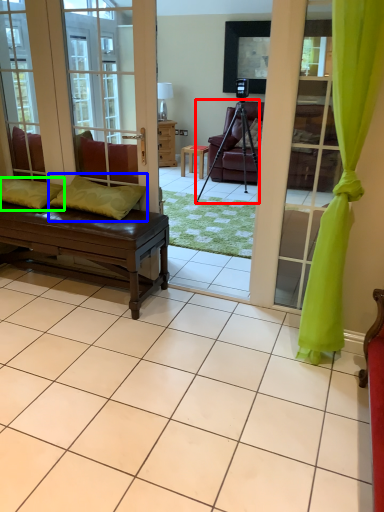
Question: Estimate the real-world distances between objects in this image. Which object is farther from tripod (highlighted by a red box), pillow (highlighted by a blue box) or pillow (highlighted by a green box)?

Choices:
 (A) pillow
 (B) pillow

Answer: (B)